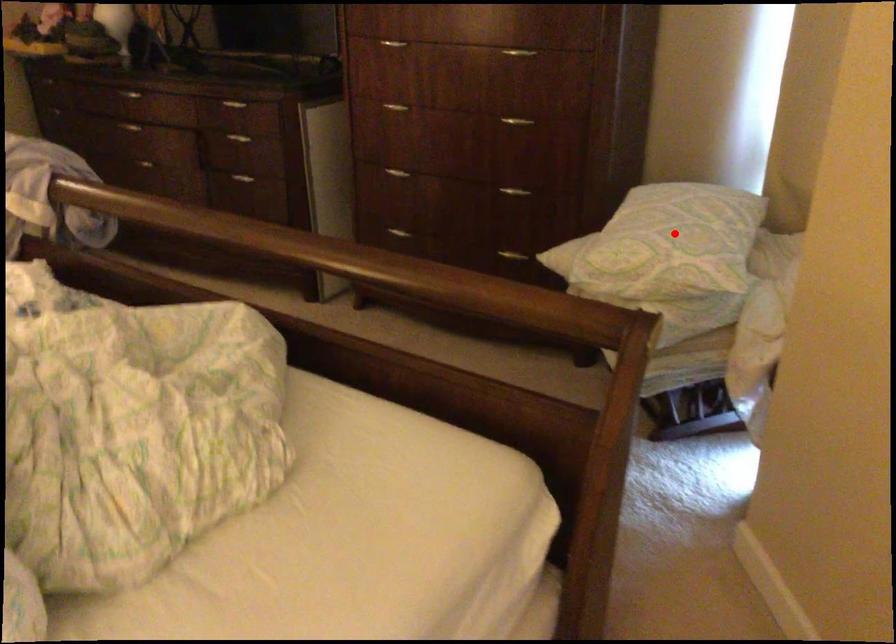
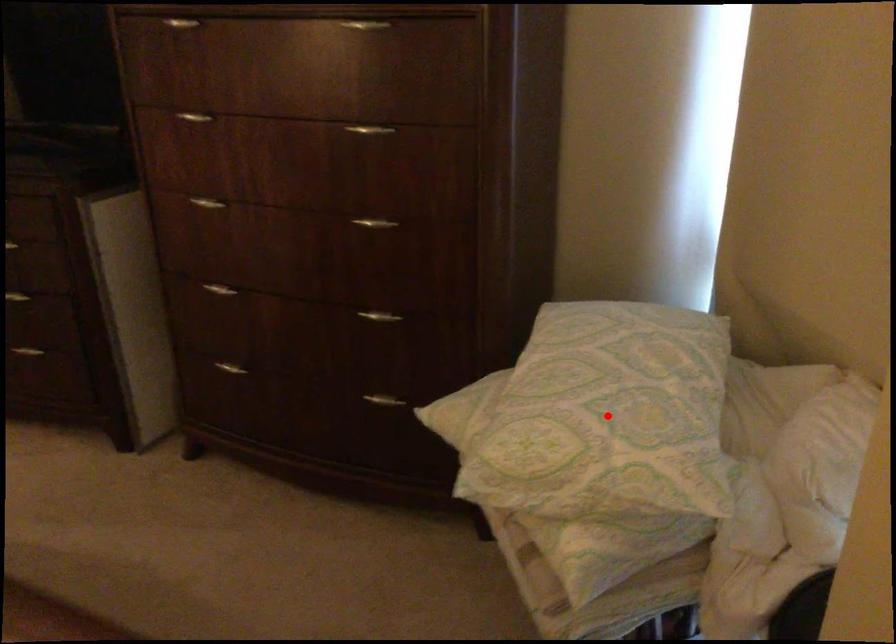
I am providing you with two images of the same scene from different viewpoints. A red point is marked on the first image and another point is marked on the second image. Is the marked point in image1 the same physical position as the marked point in image2?

Yes